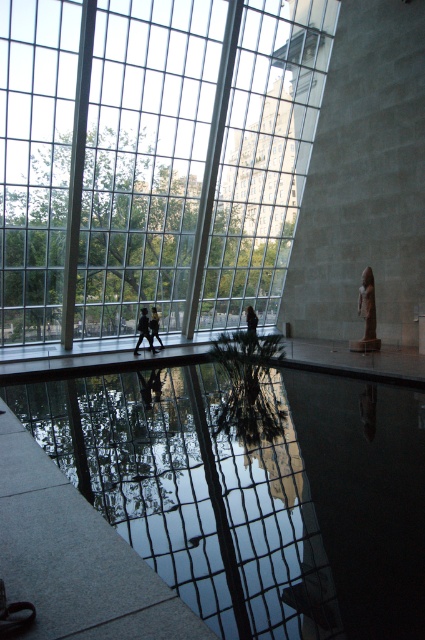
You are standing in the room and want to reach the point marked at coordinates (227, 456). Given that the room is 30 feet long from front to back, can you walk directly to that point without needing to detour?

The point marked at coordinates (227, 456) is 24.50 feet away from the camera, which is within the 30 feet length of the room. Therefore, you can walk directly to that point without needing to detour.